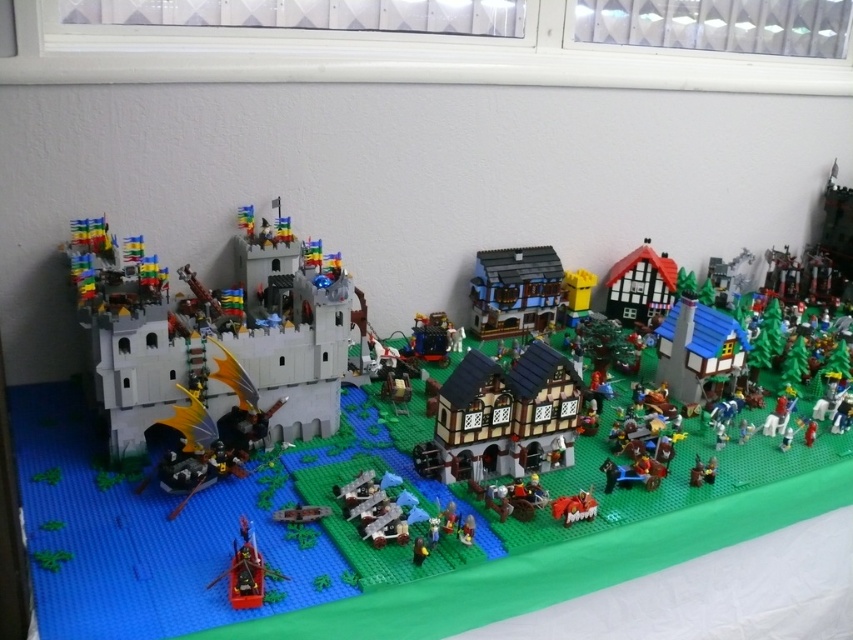
Question: Is brown/timbered house at center bigger than shiny red boat at lower left?

Choices:
 (A) no
 (B) yes

Answer: (B)

Question: Which of the following is the farthest from the observer?

Choices:
 (A) shiny red boat at lower left
 (B) brown/timbered house at center

Answer: (B)

Question: Which object is closer to the camera taking this photo?

Choices:
 (A) shiny red boat at lower left
 (B) brown/timbered house at center
 (C) wooden house at center

Answer: (A)

Question: Is brown/timbered house at center behind shiny red boat at lower left?

Choices:
 (A) yes
 (B) no

Answer: (A)

Question: Is brown/timbered house at center to the right of wooden house at center from the viewer's perspective?

Choices:
 (A) no
 (B) yes

Answer: (A)

Question: Which point is closer to the camera?

Choices:
 (A) white matte castle at left
 (B) brown/timbered house at center
 (C) shiny red boat at lower left

Answer: (C)